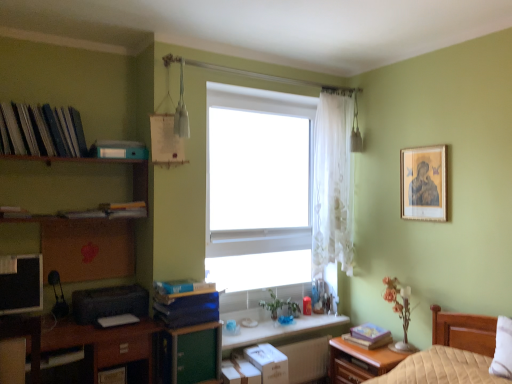
You are a GUI agent. You are given a task and a screenshot of the screen. Output one action in this format:
    pyautogui.click(x=<x>, y=<y>)
    Task: Click on the free space underneath matte black monitor at left (from a real-world perspective)
    This screenshot has width=512, height=384.
    Given the screenshot: What is the action you would take?
    pyautogui.click(x=12, y=323)